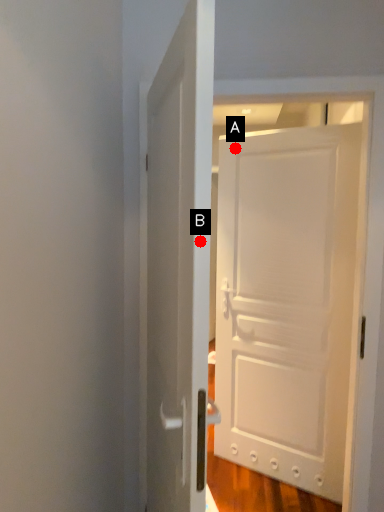
Question: Two points are circled on the image, labeled by A and B beside each circle. Which point is closer to the camera taking this photo?

Choices:
 (A) A is closer
 (B) B is closer

Answer: (B)